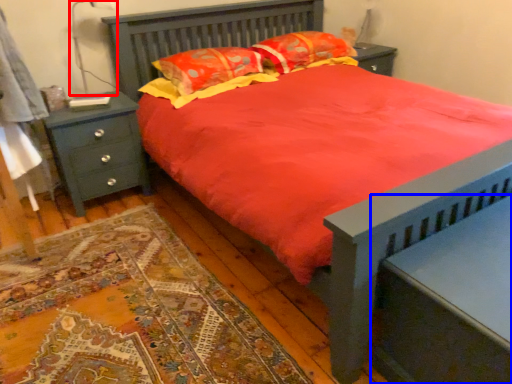
Question: Which of the following is the farthest to the observer, table lamp (highlighted by a red box) or nightstand (highlighted by a blue box)?

Choices:
 (A) table lamp
 (B) nightstand

Answer: (A)